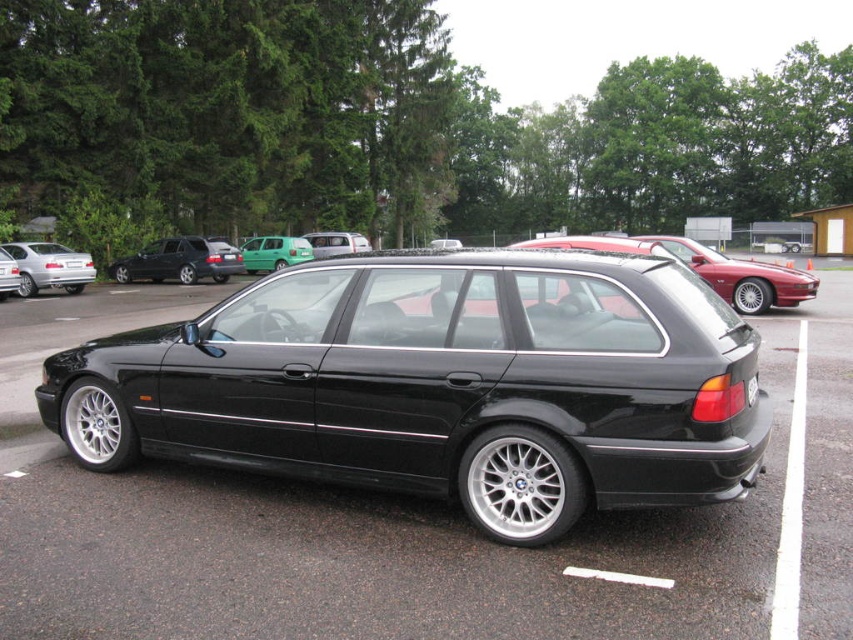
Question: Does black metallic car at center appear under metallic red car at upper right?

Choices:
 (A) no
 (B) yes

Answer: (B)

Question: Considering the relative positions of metallic silver van at center and matte black wagon at center in the image provided, where is metallic silver van at center located with respect to matte black wagon at center?

Choices:
 (A) right
 (B) left

Answer: (A)

Question: Which object is positioned closest to the silver metallic sedan at left?

Choices:
 (A) matte black wagon at center
 (B) green matte hatchback at center
 (C) black plastic license plate at rear
 (D) black metallic car at center

Answer: (A)

Question: Is black metallic car at center smaller than metallic red car at upper right?

Choices:
 (A) yes
 (B) no

Answer: (A)

Question: Among these objects, which one is farthest from the camera?

Choices:
 (A) silver metallic sedan at left
 (B) black metallic car at center
 (C) satin black wagon at center

Answer: (C)

Question: Among these objects, which one is nearest to the camera?

Choices:
 (A) silver metallic sedan at left
 (B) metallic red car at upper right
 (C) green matte hatchback at center

Answer: (B)